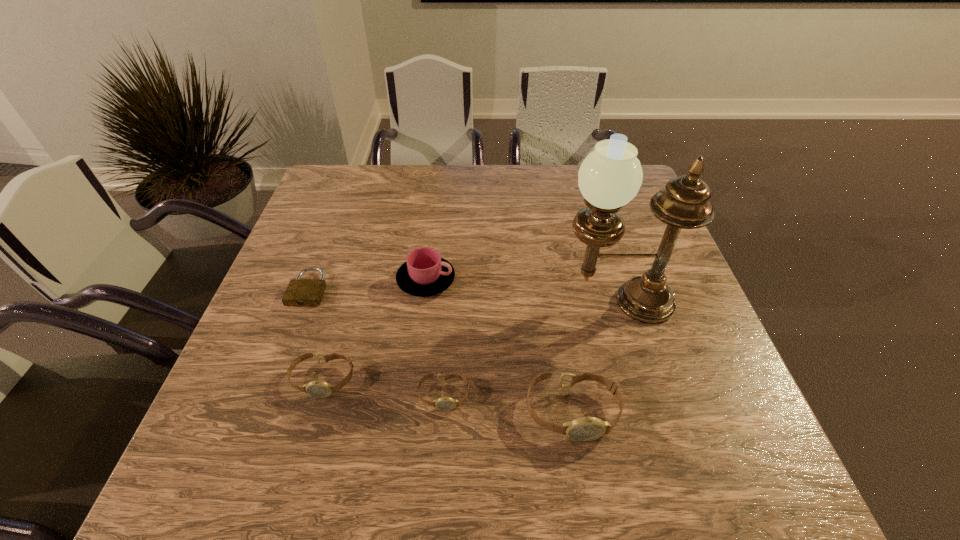
Identify which object is the nearest to the cup. Please provide its 2D coordinates. Your answer should be formatted as a tuple, i.e. [(x, y)], where the tuple contains the x and y coordinates of a point satisfying the conditions above.

[(301, 292)]

Find the location of `watch that is the closest to the rightmost watch`. watch that is the closest to the rightmost watch is located at coordinates (445, 403).

Select which watch is the closest to the shortest object. Please provide its 2D coordinates. Your answer should be formatted as a tuple, i.e. [(x, y)], where the tuple contains the x and y coordinates of a point satisfying the conditions above.

[(320, 389)]

Find the location of `vacant region that satisfies the following two spatial constraints: 1. on the keyhole side of the oil lamp; 2. on the right side of the shortest object`. vacant region that satisfies the following two spatial constraints: 1. on the keyhole side of the oil lamp; 2. on the right side of the shortest object is located at coordinates (303, 302).

Find the location of `free spot that satisfies the following two spatial constraints: 1. on the side with the handle of the oil lamp; 2. on the left side of the cup`. free spot that satisfies the following two spatial constraints: 1. on the side with the handle of the oil lamp; 2. on the left side of the cup is located at coordinates (423, 302).